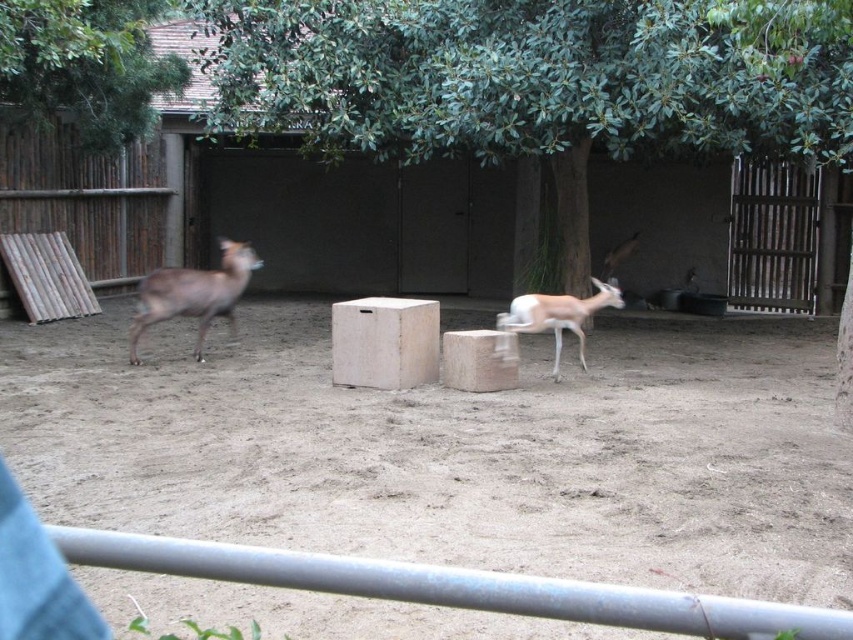
You are a zookeeper standing at the entrance of the enclosure. You need to locate the brown matte deer at left. Where exactly is it positioned in the enclosure?

The brown matte deer at left is positioned at point [193,292] in the enclosure.

You are a zookeeper planning to place a new feeding tray for the animals. The tray must be placed exactly where the white matte box at center is currently located. What are the coordinates for placing the feeding tray?

The coordinates for placing the feeding tray are at point (384,342), which is the current location of the white matte box at center.

You are a zookeeper observing the enclosure. You need to place a new feeding tray between the brown dirt field at center and the light brown fur antelope at center. Based on their positions, where should the feeding tray be placed?

The feeding tray should be placed above the brown dirt field at center since it is below the light brown fur antelope at center, meaning the antelope is positioned higher up relative to the dirt field.